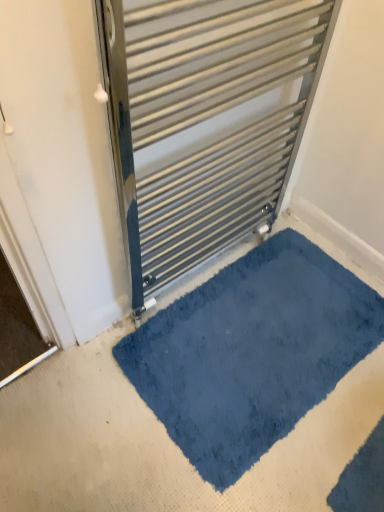
This screenshot has height=512, width=384. What are the coordinates of `metallic silver radiator at center` in the screenshot? It's located at (205, 121).

What do you see at coordinates (205, 121) in the screenshot? I see `metallic silver radiator at center` at bounding box center [205, 121].

Where is `blue plush bath mat at lower center`? This screenshot has width=384, height=512. blue plush bath mat at lower center is located at coordinates (251, 352).

What is the approximate height of blue plush bath mat at lower center?

It is 1.68 inches.

What do you see at coordinates (251, 352) in the screenshot? I see `blue plush bath mat at lower center` at bounding box center [251, 352].

I want to click on metallic silver radiator at center, so click(205, 121).

Would you say metallic silver radiator at center is to the left or to the right of blue plush bath mat at lower center in the picture?

Based on their positions, metallic silver radiator at center is located to the left of blue plush bath mat at lower center.

Considering their positions, is metallic silver radiator at center located in front of or behind blue plush bath mat at lower center?

metallic silver radiator at center is in front of blue plush bath mat at lower center.

Between point (172, 114) and point (383, 467), which one is positioned in front?

Point (172, 114)

Consider the image. From the image's perspective, is metallic silver radiator at center located above blue plush bath mat at lower center?

Indeed, from the image's perspective, metallic silver radiator at center is shown above blue plush bath mat at lower center.

From a real-world perspective, is metallic silver radiator at center physically above blue plush bath mat at lower center?

Yes, from a real-world perspective, metallic silver radiator at center is over blue plush bath mat at lower center

Can you confirm if metallic silver radiator at center is thinner than blue plush bath mat at lower center?

Indeed, metallic silver radiator at center has a lesser width compared to blue plush bath mat at lower center.

Between metallic silver radiator at center and blue plush bath mat at lower center, which one has less height?

Standing shorter between the two is blue plush bath mat at lower center.

Between metallic silver radiator at center and blue plush bath mat at lower center, which one has smaller size?

blue plush bath mat at lower center.

From the picture: Do you think metallic silver radiator at center is within blue plush bath mat at lower center, or outside of it?

metallic silver radiator at center is located beyond the bounds of blue plush bath mat at lower center.

From the picture: Is metallic silver radiator at center directly adjacent to blue plush bath mat at lower center?

No, metallic silver radiator at center is not making contact with blue plush bath mat at lower center.

Is metallic silver radiator at center facing towards blue plush bath mat at lower center?

Yes, metallic silver radiator at center is oriented towards blue plush bath mat at lower center.

Consider the image. How different are the orientations of metallic silver radiator at center and blue plush bath mat at lower center in degrees?

The facing directions of metallic silver radiator at center and blue plush bath mat at lower center are 180 degrees apart.

How much distance is there between metallic silver radiator at center and blue plush bath mat at lower center?

metallic silver radiator at center and blue plush bath mat at lower center are 16.65 inches apart from each other.

The image size is (384, 512). I want to click on bath mat behind the metallic silver radiator at center, so click(251, 352).

Is blue plush bath mat at lower center to the right of metallic silver radiator at center from the viewer's perspective?

Correct, you'll find blue plush bath mat at lower center to the right of metallic silver radiator at center.

Does blue plush bath mat at lower center lie in front of metallic silver radiator at center?

No, the depth of blue plush bath mat at lower center is greater than that of metallic silver radiator at center.

Does point (281, 345) appear closer or farther from the camera than point (138, 175)?

Point (281, 345).

From the image's perspective, is blue plush bath mat at lower center above or below metallic silver radiator at center?

Based on their image positions, blue plush bath mat at lower center is located beneath metallic silver radiator at center.

From a real-world perspective, which is physically above, blue plush bath mat at lower center or metallic silver radiator at center?

In real-world perspective, metallic silver radiator at center is above.

Is blue plush bath mat at lower center wider than metallic silver radiator at center?

Yes, blue plush bath mat at lower center is wider than metallic silver radiator at center.

Who is taller, blue plush bath mat at lower center or metallic silver radiator at center?

Standing taller between the two is metallic silver radiator at center.

Which of these two, blue plush bath mat at lower center or metallic silver radiator at center, is bigger?

metallic silver radiator at center is bigger.

Is metallic silver radiator at center completely or partially inside blue plush bath mat at lower center?

No, metallic silver radiator at center is not surrounded by blue plush bath mat at lower center.

Would you consider blue plush bath mat at lower center to be distant from metallic silver radiator at center?

blue plush bath mat at lower center is near metallic silver radiator at center, not far away.

Is blue plush bath mat at lower center facing towards metallic silver radiator at center?

No, blue plush bath mat at lower center is not turned towards metallic silver radiator at center.

How distant is blue plush bath mat at lower center from metallic silver radiator at center?

blue plush bath mat at lower center is 16.65 inches away from metallic silver radiator at center.

At what (x,y) coordinates should I click in order to perform the action: click on bath mat behind the metallic silver radiator at center. Please return your answer as a coordinate pair (x, y). The image size is (384, 512). Looking at the image, I should click on (251, 352).

Where is `bath mat that appears below the metallic silver radiator at center (from a real-world perspective)`? This screenshot has height=512, width=384. bath mat that appears below the metallic silver radiator at center (from a real-world perspective) is located at coordinates (251, 352).

There is a blue plush bath mat at lower center. Identify the location of radiator above it (from a real-world perspective). (205, 121).